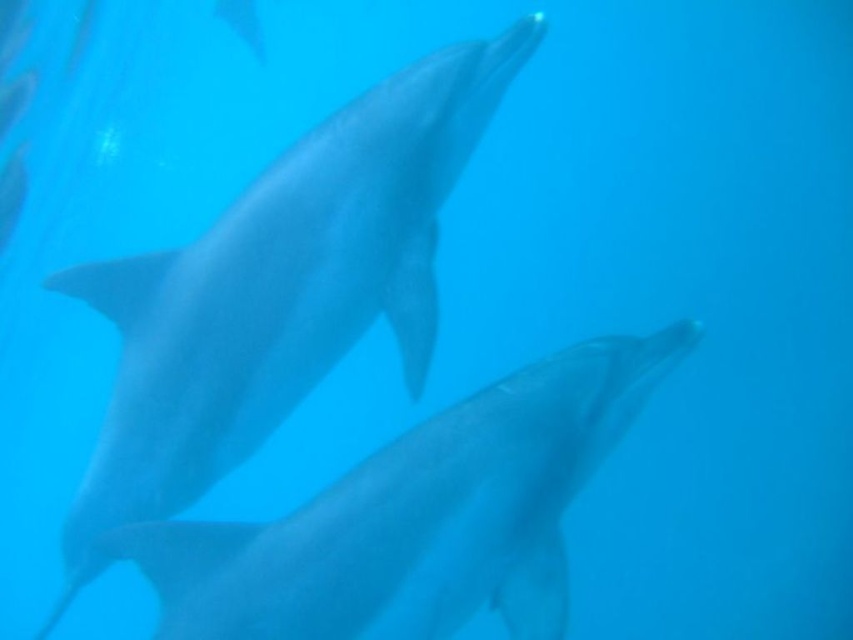
Can you confirm if sleek gray dolphin at center is positioned to the left of smooth gray dolphin at center?

Yes, sleek gray dolphin at center is to the left of smooth gray dolphin at center.

Looking at this image, is sleek gray dolphin at center bigger than smooth gray dolphin at center?

Yes, sleek gray dolphin at center is bigger than smooth gray dolphin at center.

At what (x,y) coordinates should I click in order to perform the action: click on sleek gray dolphin at center. Please return your answer as a coordinate pair (x, y). The width and height of the screenshot is (853, 640). Looking at the image, I should click on (279, 291).

The image size is (853, 640). What are the coordinates of `sleek gray dolphin at center` in the screenshot? It's located at (279, 291).